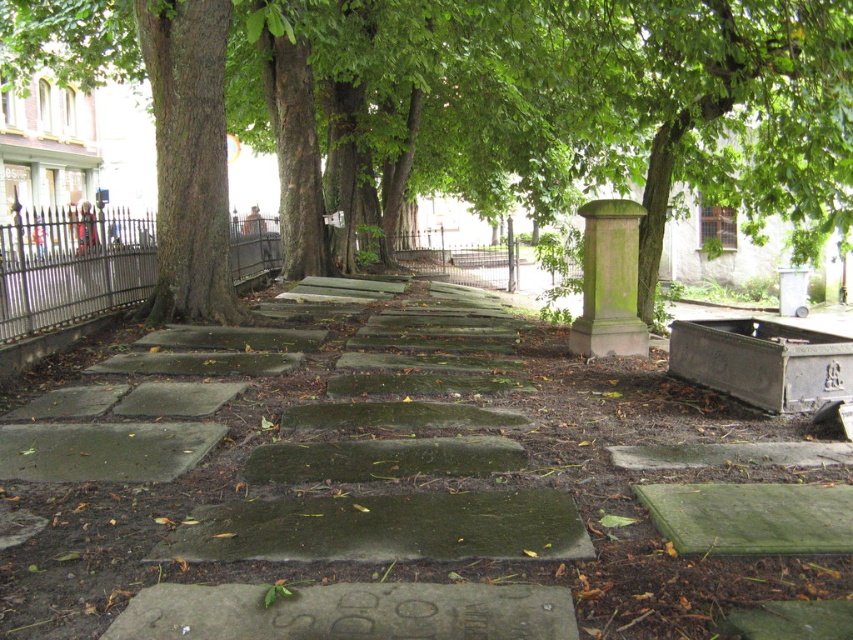
You are standing at the entrance of the cemetery and want to walk directly towards the green mossy stone at center. According to the coordinates provided, in which direction should you head relative to your current position?

The green mossy stone at center is located at coordinates point (392, 492). Since the x coordinate is 0.770, which is greater than 0.5, you should move to the right. The y coordinate is 0.461, which is slightly less than 0.5, so you should move slightly downward. Therefore, you should head to the right and slightly downward to reach the green mossy stone at center.